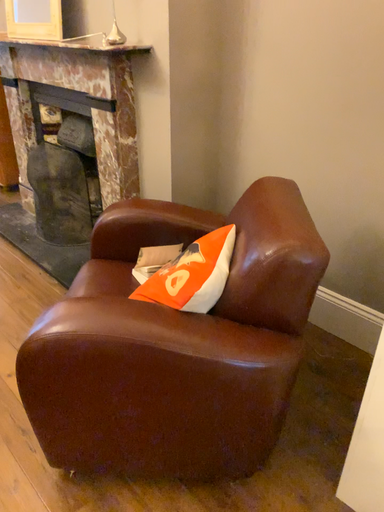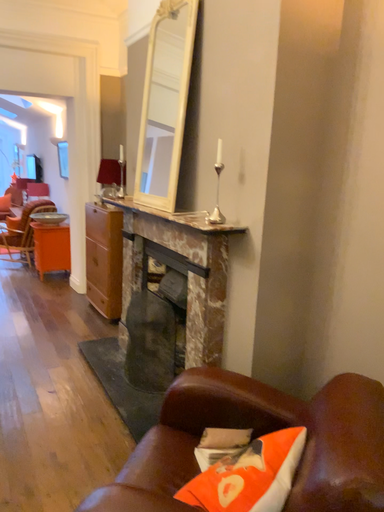
Question: How did the camera likely rotate when shooting the video?

Choices:
 (A) rotated right
 (B) rotated left

Answer: (B)